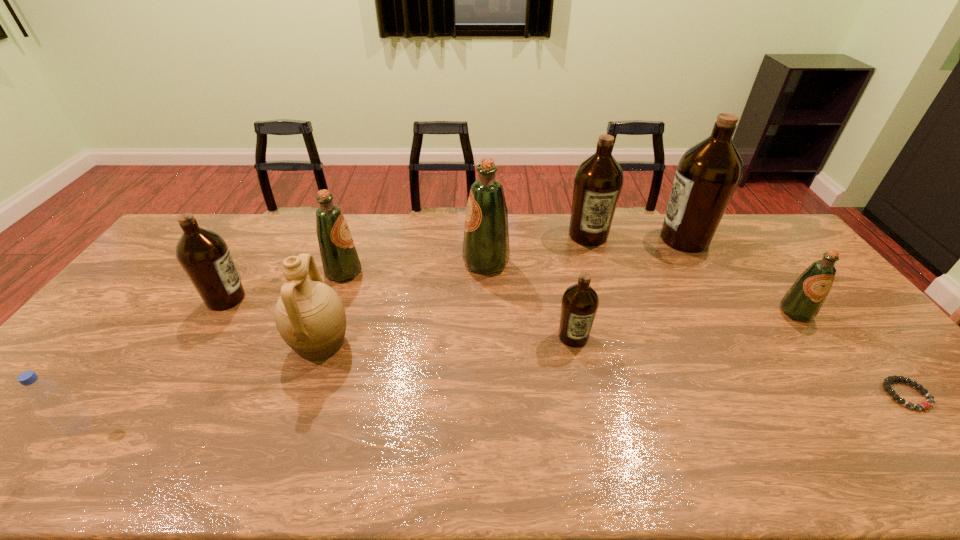
Identify the location of the biggest brown olive oil. (707, 175).

Find the location of `the tallest olive oil`. the tallest olive oil is located at coordinates (707, 175).

Where is `the third olive oil from right to left`? The height and width of the screenshot is (540, 960). the third olive oil from right to left is located at coordinates (598, 181).

Where is `the second brown olive oil from right to left`? This screenshot has width=960, height=540. the second brown olive oil from right to left is located at coordinates (598, 181).

Where is `the fifth object from left to right`? the fifth object from left to right is located at coordinates (486, 250).

I want to click on the biggest green olive oil, so click(486, 250).

What are the coordinates of `the leftmost green olive oil` in the screenshot? It's located at (340, 261).

This screenshot has height=540, width=960. In order to click on the second smallest green olive oil in this screenshot , I will do `click(340, 261)`.

Locate an element on the screen. The image size is (960, 540). the second nearest brown olive oil is located at coordinates (203, 254).

Find the location of `the leftmost olive oil`. the leftmost olive oil is located at coordinates (203, 254).